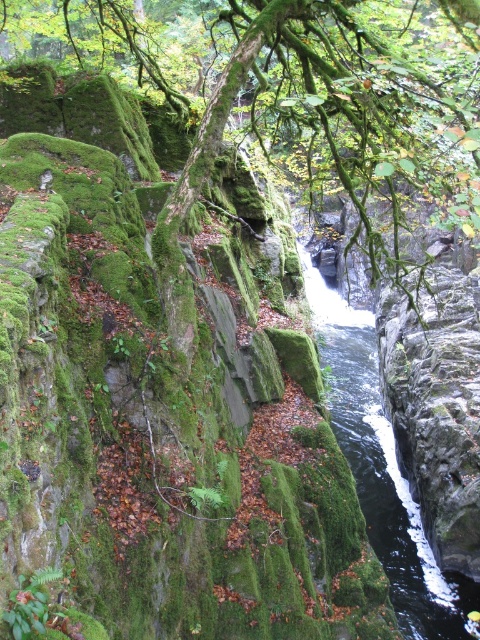
Question: Does green mossy branch at center appear on the left side of black glossy water at center?

Choices:
 (A) yes
 (B) no

Answer: (A)

Question: Which point is farther from the camera taking this photo?

Choices:
 (A) (321, 93)
 (B) (407, 593)

Answer: (B)

Question: Does green mossy branch at center appear under black glossy water at center?

Choices:
 (A) yes
 (B) no

Answer: (B)

Question: Does green mossy branch at center have a smaller size compared to black glossy water at center?

Choices:
 (A) no
 (B) yes

Answer: (A)

Question: Which point is farther to the camera?

Choices:
 (A) green mossy branch at center
 (B) black glossy water at center

Answer: (B)